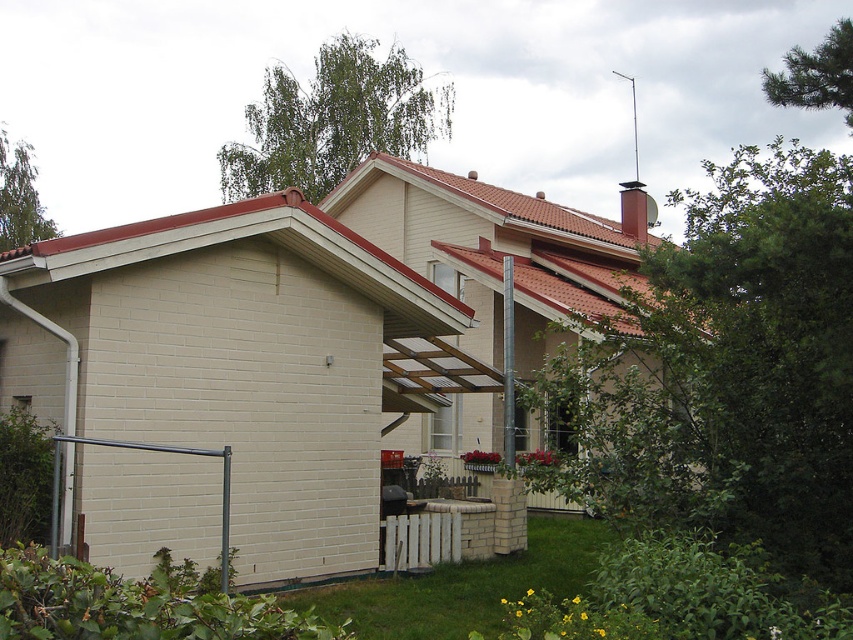
You are standing at the entrance of the residential house. You want to walk towards the white wooden fence at lower center. What direction should you walk in?

The white wooden fence at lower center is located at point 0.844 on the x axis and 0.495 on the y axis. Since the entrance is typically at the front of the house, which would be near the lower part of the image, you should walk forward towards the center to reach the white wooden fence at lower center.

You are standing in the front yard of the house and want to walk towards the white wooden fence at lower center and the metallic gray rail at lower left. Which object will you encounter first as you move forward?

You will encounter the white wooden fence at lower center first because it is closer to you than the metallic gray rail at lower left, which is further away.